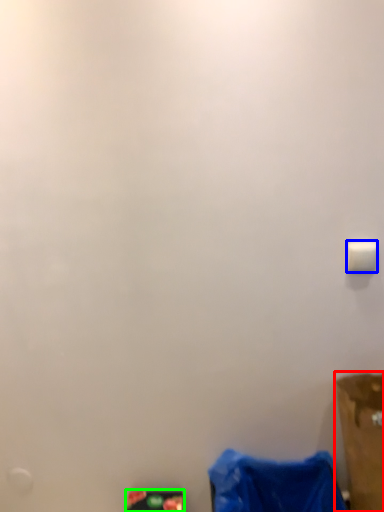
Question: Considering the real-world distances, which object is closest to furniture (highlighted by a red box)? light switch (highlighted by a blue box) or waste (highlighted by a green box).

Choices:
 (A) light switch
 (B) waste

Answer: (A)